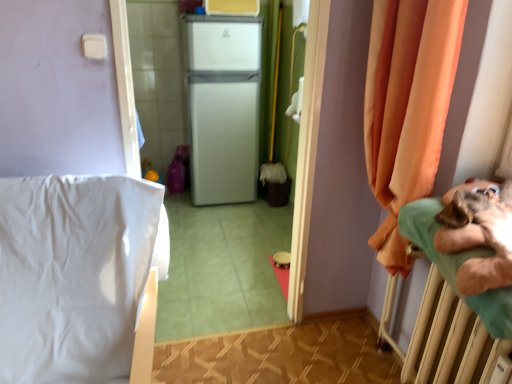
Question: Does white matte refrigerator at center touch green fabric hospital bed at right?

Choices:
 (A) no
 (B) yes

Answer: (A)

Question: Is white matte refrigerator at center further to the viewer compared to green fabric hospital bed at right?

Choices:
 (A) yes
 (B) no

Answer: (A)

Question: Does white matte refrigerator at center have a greater width compared to green fabric hospital bed at right?

Choices:
 (A) no
 (B) yes

Answer: (A)

Question: From the image's perspective, is white matte refrigerator at center located beneath green fabric hospital bed at right?

Choices:
 (A) yes
 (B) no

Answer: (B)

Question: Does white matte refrigerator at center contain green fabric hospital bed at right?

Choices:
 (A) no
 (B) yes

Answer: (A)

Question: Can you confirm if white matte refrigerator at center is smaller than green fabric hospital bed at right?

Choices:
 (A) yes
 (B) no

Answer: (B)

Question: From a real-world perspective, is orange fabric curtain at right on white smooth bedsheet at left?

Choices:
 (A) yes
 (B) no

Answer: (A)

Question: Considering the relative sizes of orange fabric curtain at right and white smooth bedsheet at left in the image provided, is orange fabric curtain at right bigger than white smooth bedsheet at left?

Choices:
 (A) yes
 (B) no

Answer: (B)

Question: Does orange fabric curtain at right have a smaller size compared to white smooth bedsheet at left?

Choices:
 (A) no
 (B) yes

Answer: (B)

Question: Does orange fabric curtain at right lie behind white smooth bedsheet at left?

Choices:
 (A) yes
 (B) no

Answer: (A)

Question: Can you confirm if orange fabric curtain at right is positioned to the left of white smooth bedsheet at left?

Choices:
 (A) no
 (B) yes

Answer: (A)

Question: Does orange fabric curtain at right have a lesser width compared to white smooth bedsheet at left?

Choices:
 (A) yes
 (B) no

Answer: (A)

Question: Is green fabric hospital bed at right outside orange fabric curtain at right?

Choices:
 (A) yes
 (B) no

Answer: (A)